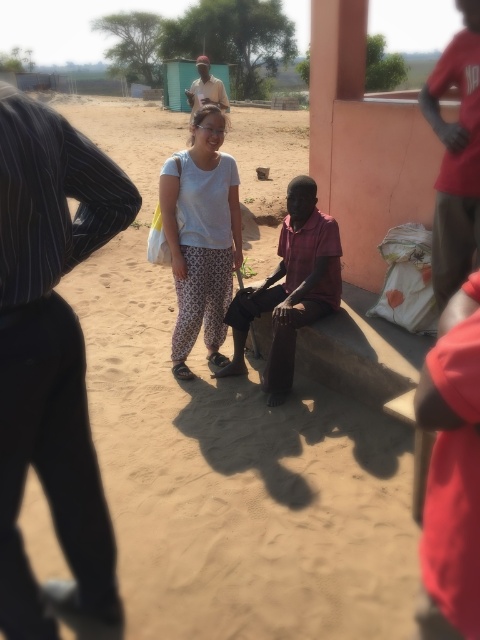
You are standing at the point labeled as point (8, 403) in the image. You want to walk to the shed in the background. Is the shed behind you or in front of you?

The shed is in front of you because you are at point (8, 403), and the shed is in the background which is ahead of your current position.

You are standing at the camera position and want to hand a map to the black striped shirt at left. Can you reach them without moving if your arm can extend 1.2 meters?

The black striped shirt at left is 1.28 meters away from the camera. Since your arm can only extend 1.2 meters, you cannot reach them without moving closer.

You are a fashion designer observing the two shirts at the center of the image. The white cotton shirt at center and the dark red fabric shirt at center. Which one has a narrower width?

The white cotton shirt at center has a narrower width than the dark red fabric shirt at center according to the description.